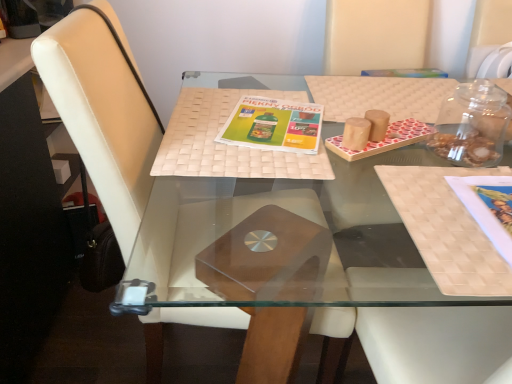
Locate an element on the screen. The image size is (512, 384). vacant area that is in front of green matte magazine at center, which appears as the first book cover when viewed from the left is located at coordinates (264, 167).